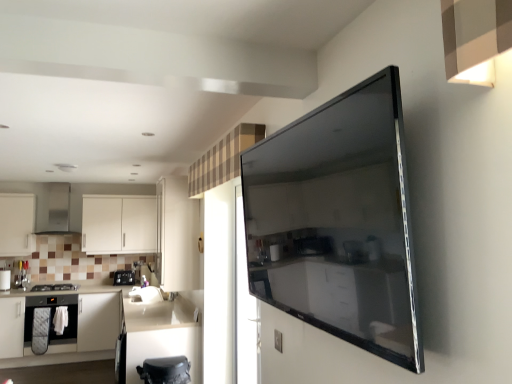
Question: Considering the relative positions of satin black oven at left, which ranks as the 2th home appliance in bottom-to-top order, and transparent glass door at center in the image provided, is satin black oven at left, which ranks as the 2th home appliance in bottom-to-top order, to the left of transparent glass door at center from the viewer's perspective?

Choices:
 (A) yes
 (B) no

Answer: (A)

Question: Does satin black oven at left, placed as the 1th home appliance when sorted from top to bottom, have a smaller size compared to transparent glass door at center?

Choices:
 (A) no
 (B) yes

Answer: (B)

Question: Would you consider satin black oven at left, placed as the 1th home appliance when sorted from top to bottom, to be distant from transparent glass door at center?

Choices:
 (A) no
 (B) yes

Answer: (B)

Question: Is satin black oven at left, which ranks as the 2th home appliance in bottom-to-top order, thinner than transparent glass door at center?

Choices:
 (A) yes
 (B) no

Answer: (B)

Question: Is satin black oven at left, placed as the 1th home appliance when sorted from top to bottom, positioned before transparent glass door at center?

Choices:
 (A) no
 (B) yes

Answer: (A)

Question: Are satin black oven at left, placed as the 1th home appliance when sorted from top to bottom, and transparent glass door at center making contact?

Choices:
 (A) yes
 (B) no

Answer: (B)

Question: Would you consider white matte cabinet at left, the 4th cabinetry when ordered from back to front, to be distant from matte black oven at left, arranged as the 1th home appliance when ordered from the bottom?

Choices:
 (A) yes
 (B) no

Answer: (A)

Question: Is matte black oven at left, arranged as the second home appliance when viewed from the top, inside white matte cabinet at left, which is the 3th cabinetry in front-to-back order?

Choices:
 (A) no
 (B) yes

Answer: (A)

Question: Considering the relative sizes of white matte cabinet at left, the 4th cabinetry when ordered from back to front, and matte black oven at left, arranged as the second home appliance when viewed from the top, in the image provided, is white matte cabinet at left, the 4th cabinetry when ordered from back to front, thinner than matte black oven at left, arranged as the second home appliance when viewed from the top,?

Choices:
 (A) no
 (B) yes

Answer: (B)

Question: Is white matte cabinet at left, which is the 3th cabinetry in front-to-back order, with matte black oven at left, arranged as the second home appliance when viewed from the top?

Choices:
 (A) no
 (B) yes

Answer: (A)

Question: Can you confirm if white matte cabinet at left, the 4th cabinetry when ordered from back to front, is shorter than matte black oven at left, arranged as the 1th home appliance when ordered from the bottom?

Choices:
 (A) yes
 (B) no

Answer: (B)

Question: Is white matte cabinet at left, which is the 3th cabinetry in front-to-back order, facing towards matte black oven at left, arranged as the 1th home appliance when ordered from the bottom?

Choices:
 (A) yes
 (B) no

Answer: (B)

Question: Is brushed metal knife block at left, which is counted as the 3th appliance, starting from the front, beside black glass stove at left, acting as the 3th appliance starting from the right?

Choices:
 (A) yes
 (B) no

Answer: (B)